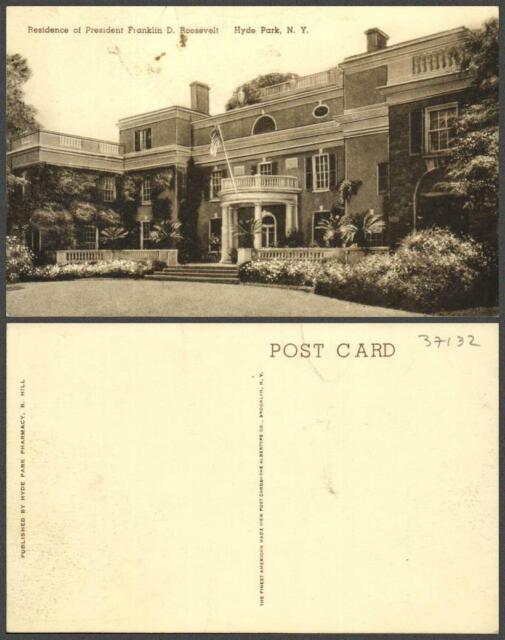
Where is `fireplace`? fireplace is located at coordinates (200, 93), (370, 40).